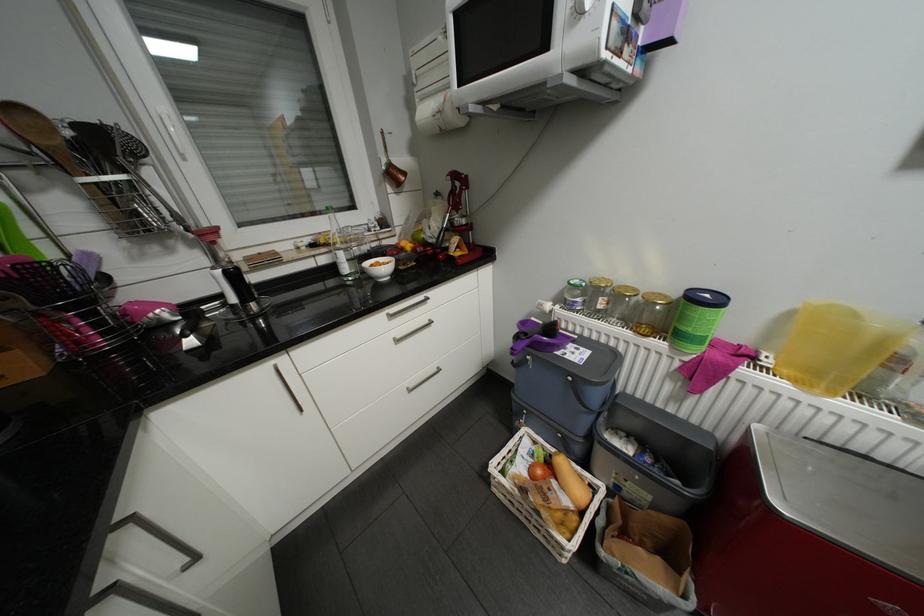
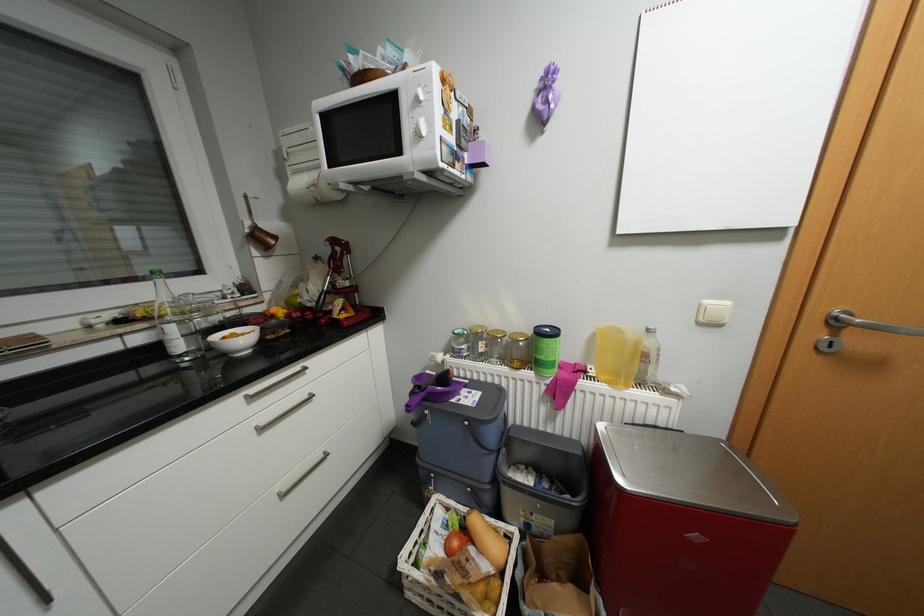
Where in the second image is the point corresponding to [438,240] from the first image?

(317, 304)